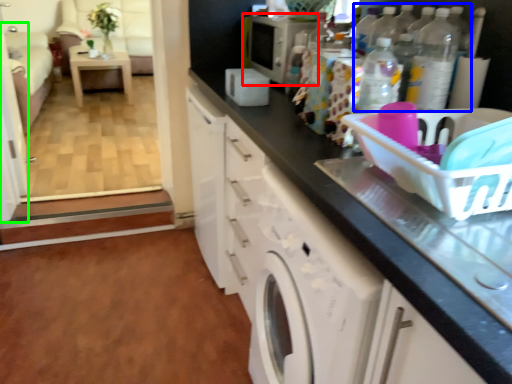
Question: Which object is positioned closest to appliance (highlighted by a red box)? Select from bottle (highlighted by a blue box) and screen door (highlighted by a green box).

Choices:
 (A) bottle
 (B) screen door

Answer: (A)